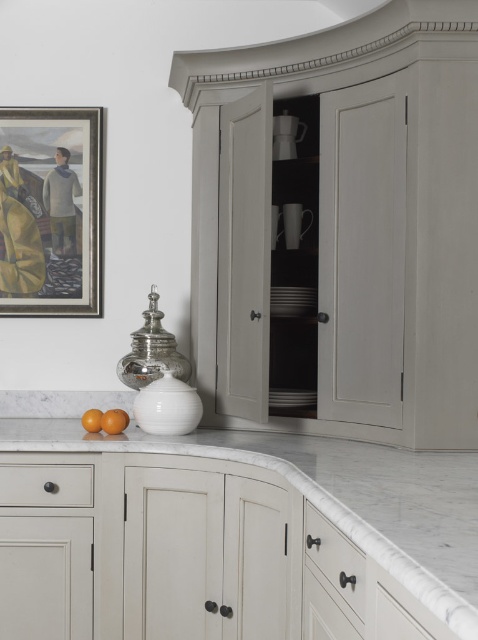
In the scene shown: You are moving a 3.5 feet wide box into the kitchen and need to place it between the matte gray cabinet at upper center and the orange matte at lower left. Will there be enough space for the box?

The distance between the matte gray cabinet at upper center and the orange matte at lower left is 3.48 feet, which is slightly less than the box width of 3.5 feet. Therefore, the box may not fit comfortably between them.

You are organizing kitchen items and need to place a new spice rack. The spice rack is 10 cm thick. You have two options for placement near the matte gray cabinet at upper center and the white marble countertop at center. Which object can accommodate the spice rack based on their thickness?

The white marble countertop at center is thicker than the matte gray cabinet at upper center, so the spice rack can be placed on the white marble countertop at center since it has sufficient thickness to support the spice rack.

You are a kitchen designer planning to install a new backsplash behind the matte gray cabinet at upper center. According to the coordinates provided, where should you position the backsplash?

The backsplash should be positioned at the coordinates (340, 225), corresponding to the location of the matte gray cabinet at upper center.